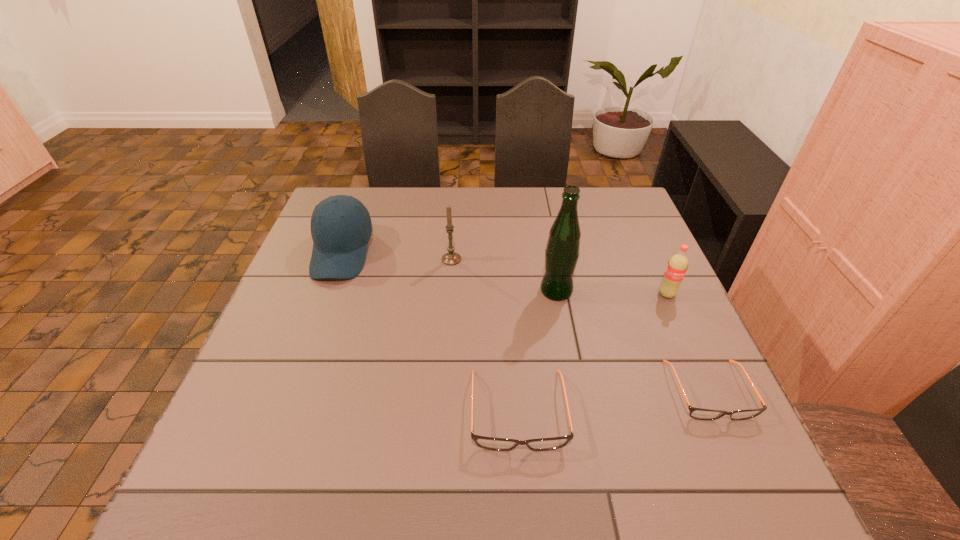
The width and height of the screenshot is (960, 540). I want to click on vacant space located on the right of the fifth object from right to left, so click(572, 259).

Image resolution: width=960 pixels, height=540 pixels. Find the location of `free space located 0.340m on the front of the beer bottle`. free space located 0.340m on the front of the beer bottle is located at coordinates (582, 428).

Find the location of a particular element. The width and height of the screenshot is (960, 540). object positioned at the far edge is located at coordinates (341, 227).

I want to click on object that is positioned at the left edge, so click(341, 227).

You are a GUI agent. You are given a task and a screenshot of the screen. Output one action in this format:
    pyautogui.click(x=<x>, y=<y>)
    Task: Click on the spectacles present at the right edge
    The width and height of the screenshot is (960, 540).
    Given the screenshot: What is the action you would take?
    [702, 414]

Where is `soda that is positioned at the right edge`? This screenshot has height=540, width=960. soda that is positioned at the right edge is located at coordinates (677, 266).

Image resolution: width=960 pixels, height=540 pixels. In order to click on object that is at the far left corner in this screenshot , I will do `click(341, 227)`.

What are the coordinates of `object located in the near right corner section of the desktop` in the screenshot? It's located at (702, 414).

Locate an element on the screen. free space at the far edge is located at coordinates (487, 193).

Find the location of a particular element. The image size is (960, 540). vacant space at the near edge is located at coordinates (314, 427).